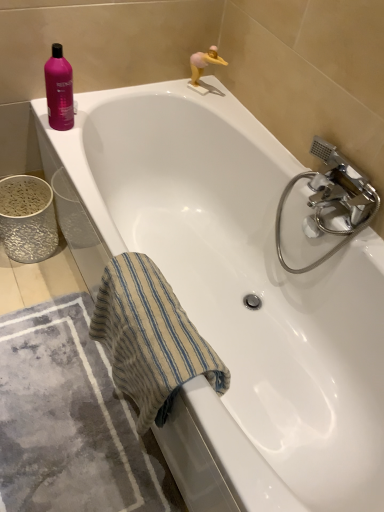
I want to click on unoccupied area in front of pink matte figurine at upper right, so click(x=215, y=106).